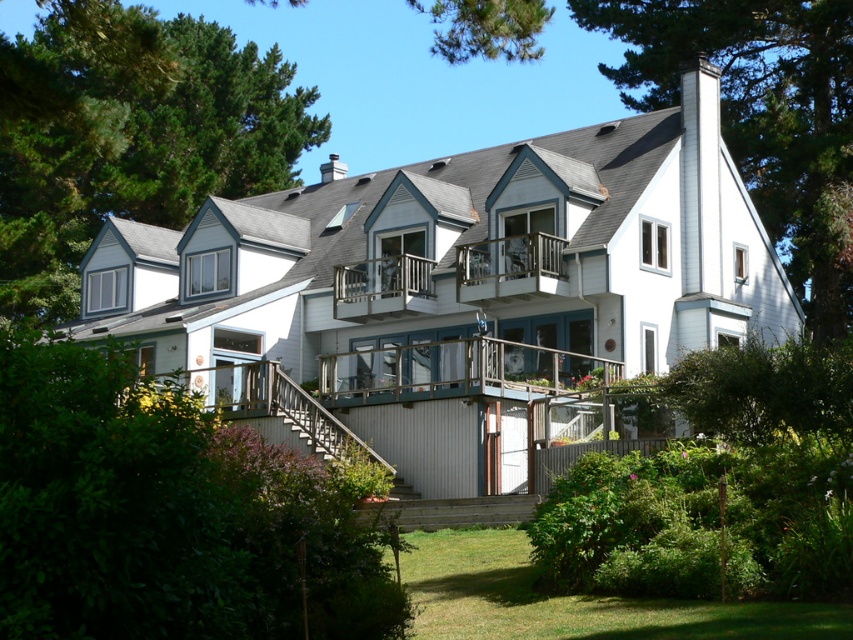
Question: Which object is closer to the camera taking this photo?

Choices:
 (A) green grass at lower center
 (B) green leafy tree at upper left

Answer: (A)

Question: Which is farther from the green leafy tree at upper right?

Choices:
 (A) green leafy bush at lower left
 (B) green leafy tree at upper left
 (C) clear glass balcony at center

Answer: (A)

Question: Can you confirm if green leafy bush at lower left is thinner than green leafy tree at upper left?

Choices:
 (A) yes
 (B) no

Answer: (A)

Question: Can you confirm if green leafy tree at upper right is positioned below green grass at lower center?

Choices:
 (A) yes
 (B) no

Answer: (B)

Question: Which point appears closest to the camera in this image?

Choices:
 (A) (805, 205)
 (B) (263, 61)
 (C) (490, 374)
 (D) (485, 538)

Answer: (D)

Question: Does green leafy tree at upper right come behind green grass at lower center?

Choices:
 (A) no
 (B) yes

Answer: (B)